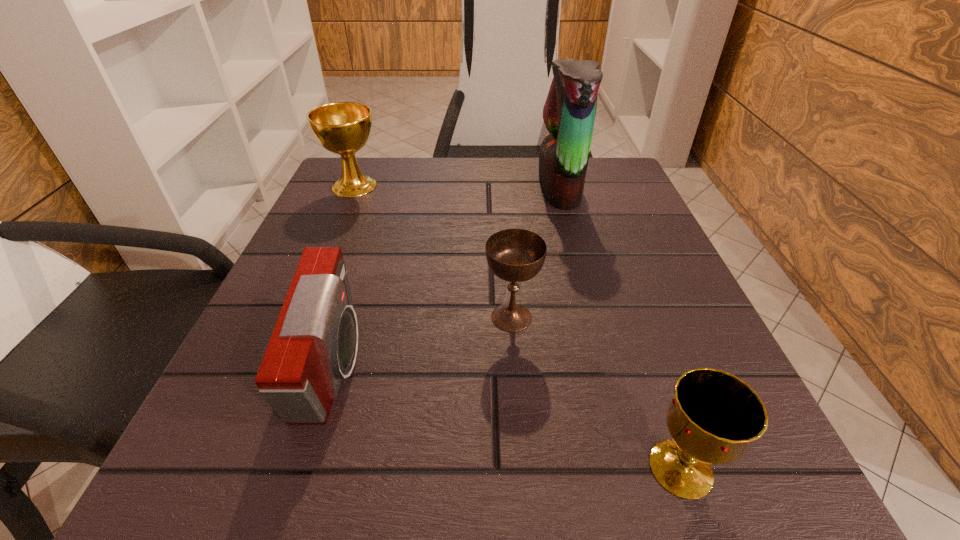
You are a GUI agent. You are given a task and a screenshot of the screen. Output one action in this format:
    pyautogui.click(x=<x>, y=<y>)
    Task: Click on the blank space that satisfies the following two spatial constraints: 1. on the back side of the nearest chalice; 2. on the front-facing side of the camera
    The width and height of the screenshot is (960, 540).
    Given the screenshot: What is the action you would take?
    pyautogui.click(x=646, y=368)